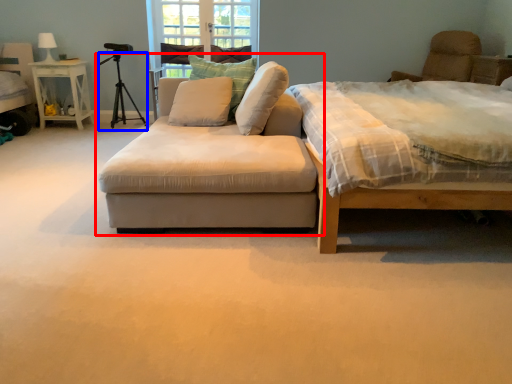
Question: Which point is closer to the camera, studio couch (highlighted by a red box) or tripod (highlighted by a blue box)?

Choices:
 (A) studio couch
 (B) tripod

Answer: (A)